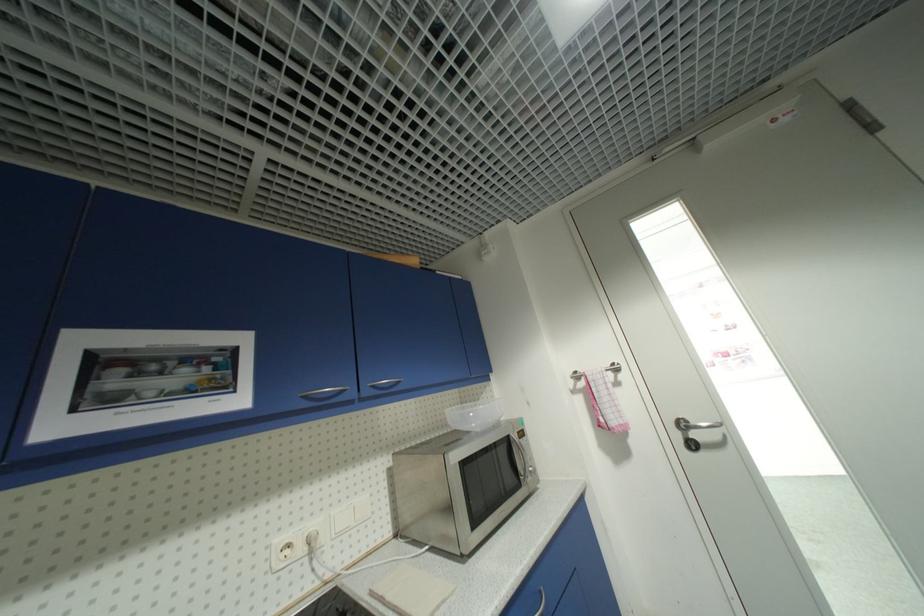
Describe the element at coordinates (523, 459) in the screenshot. The image size is (924, 616). I see `the microwave door handle` at that location.